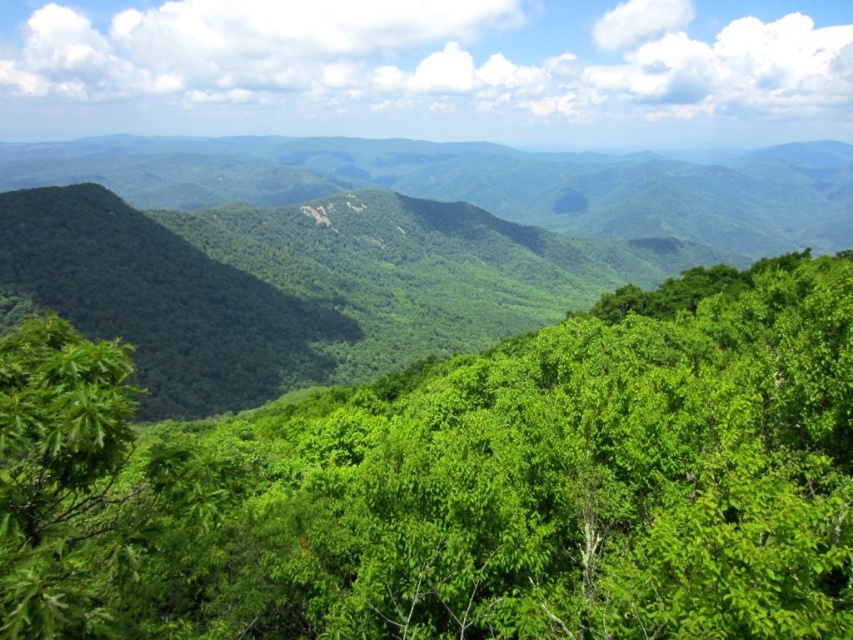
You are standing in the mountain landscape and want to take a photo of both the green leafy tree at center and the green leafy forest at center. Which one should you focus on first to ensure both are in sharp focus?

You should focus on the green leafy forest at center first because it is farther away than the green leafy tree at center. By focusing on the farther object, you can ensure both are in focus due to the depth of field.

You are a hiker standing in the mountain landscape and want to take a photo of both the green leafy tree at center and the green leafy forest at center. Which object should you frame closer to the center of your camera viewfinder to ensure both are visible in the photo?

You should frame the green leafy tree at center closer to the center of your camera viewfinder because it has a lesser width compared to the green leafy forest at center, allowing both to fit within the frame.